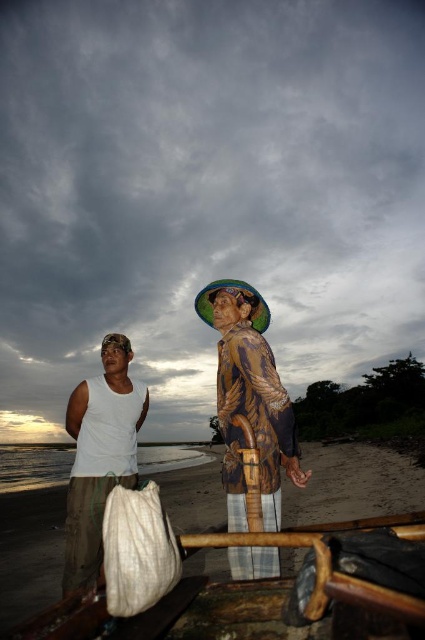
You are a photographer trying to capture the texture of the brown sand at lower center and the white matte tank top at center. Which object would you focus on first if you want to highlight the coarser texture?

The brown sand at lower center has a larger size compared to the white matte tank top at center, so focusing on the brown sand at lower center would better highlight the coarser texture.

You are standing on the beach and want to place a small flag exactly at the position of the brown sand at lower center. According to the coordinates provided, what are the exact coordinates where you should place the flag?

The brown sand at lower center is located at point (x=356, y=483), so you should place the flag at those coordinates.

You are a photographer trying to capture a photo of the brown sand at lower center and the white matte tank top at center. Based on their positions, which object will appear larger in the photo?

The brown sand at lower center appears larger in the photo because it is much taller than the white matte tank top at center.